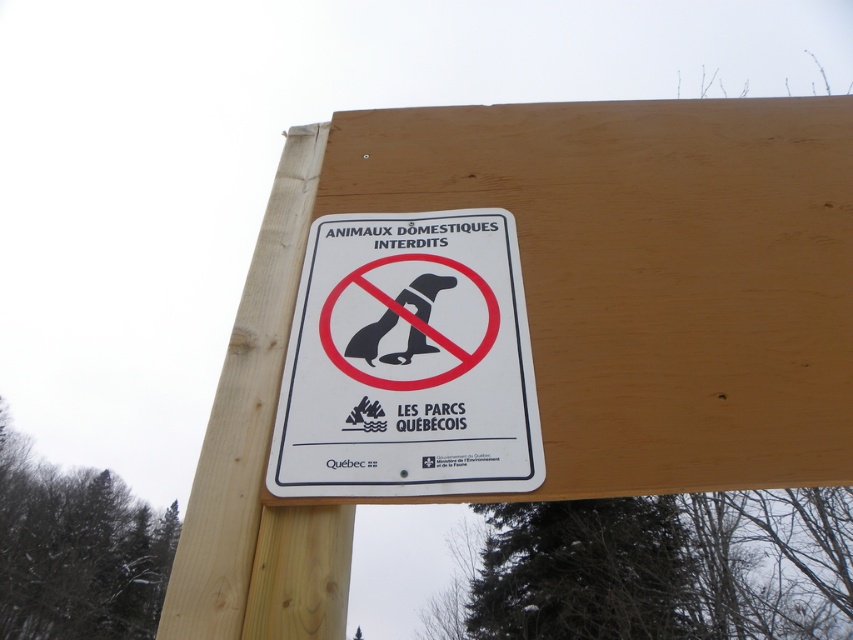
Question: Does white plastic sign at center appear on the left side of wooden post at center?

Choices:
 (A) yes
 (B) no

Answer: (B)

Question: Which point is farther from the camera taking this photo?

Choices:
 (A) (306, 150)
 (B) (508, 355)

Answer: (A)

Question: Does white plastic sign at center have a greater width compared to wooden post at center?

Choices:
 (A) no
 (B) yes

Answer: (A)

Question: Is white plastic sign at center below wooden post at center?

Choices:
 (A) yes
 (B) no

Answer: (B)